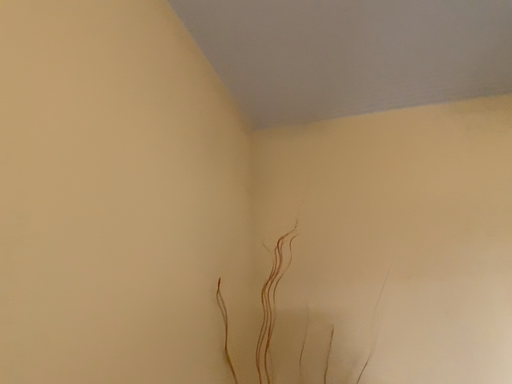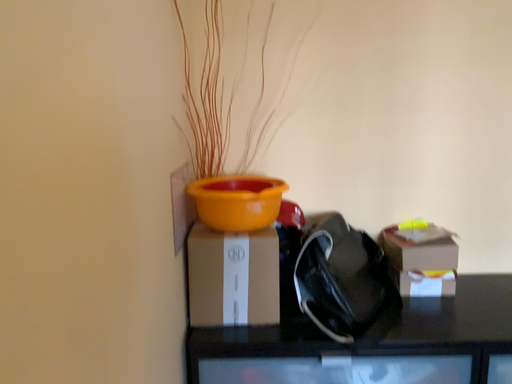
Question: How did the camera likely rotate when shooting the video?

Choices:
 (A) rotated right
 (B) rotated left

Answer: (A)